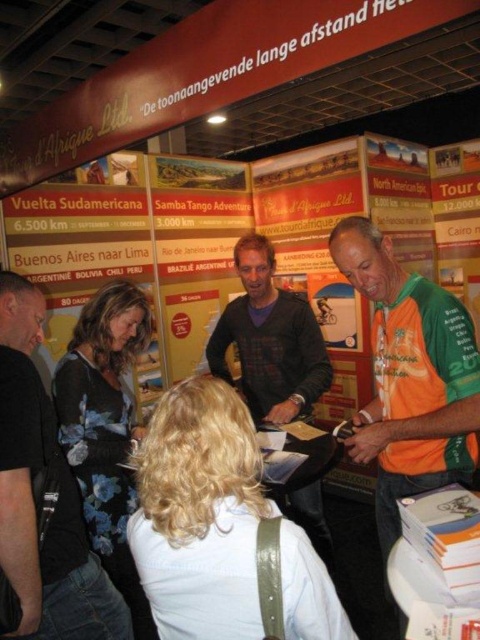
Question: Which point is farther from the camera taking this photo?

Choices:
 (A) (252, 353)
 (B) (20, 410)
 (C) (434, 348)

Answer: (A)

Question: Which object appears closest to the camera in this image?

Choices:
 (A) black fabric shirt at left
 (B) orange jersey at right

Answer: (A)

Question: Does orange jersey at right appear under dark brown sweater at center?

Choices:
 (A) yes
 (B) no

Answer: (A)

Question: Estimate the real-world distances between objects in this image. Which object is farther from the orange jersey at right?

Choices:
 (A) dark brown sweater at center
 (B) black fabric shirt at left

Answer: (B)

Question: Is orange jersey at right below black fabric shirt at left?

Choices:
 (A) yes
 (B) no

Answer: (B)

Question: Does black fabric shirt at left come in front of dark brown sweater at center?

Choices:
 (A) yes
 (B) no

Answer: (A)